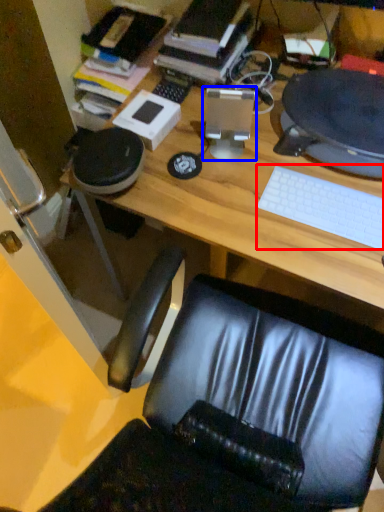
Question: Which of the following is the closest to the observer, keyboard (highlighted by a red box) or desktop computer (highlighted by a blue box)?

Choices:
 (A) keyboard
 (B) desktop computer

Answer: (A)